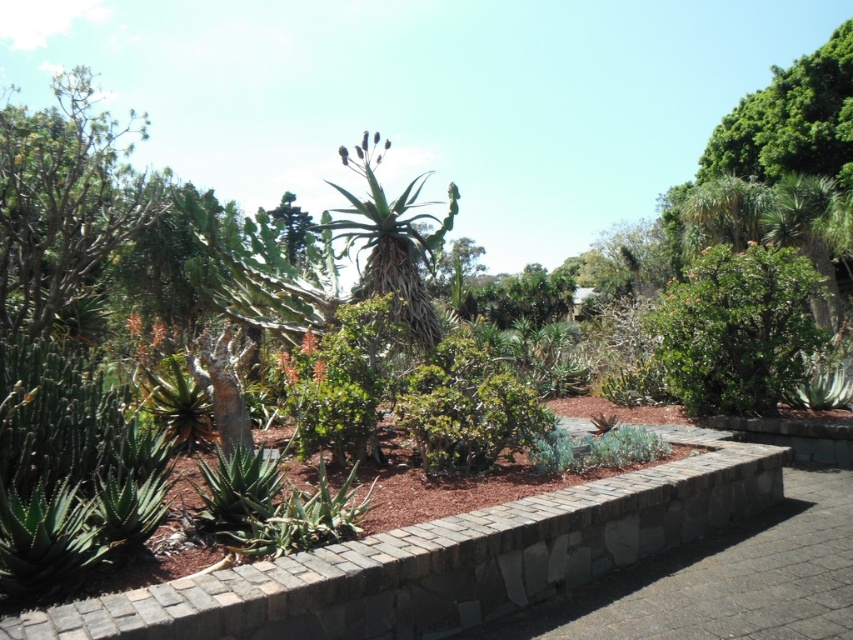
In the garden scene, there is a green leafy tree at upper left and a green leafy bush at center. Which one is larger in size?

The green leafy tree at upper left is bigger than the green leafy bush at center.

You are standing in the garden and want to walk from the green leafy tree at upper left to the green leafy bush at center. Which direction should you move to get closer to the bush?

You should move away from the viewer because the green leafy tree at upper left is closer to you than the green leafy bush at center, so moving forward would take you toward the bush.